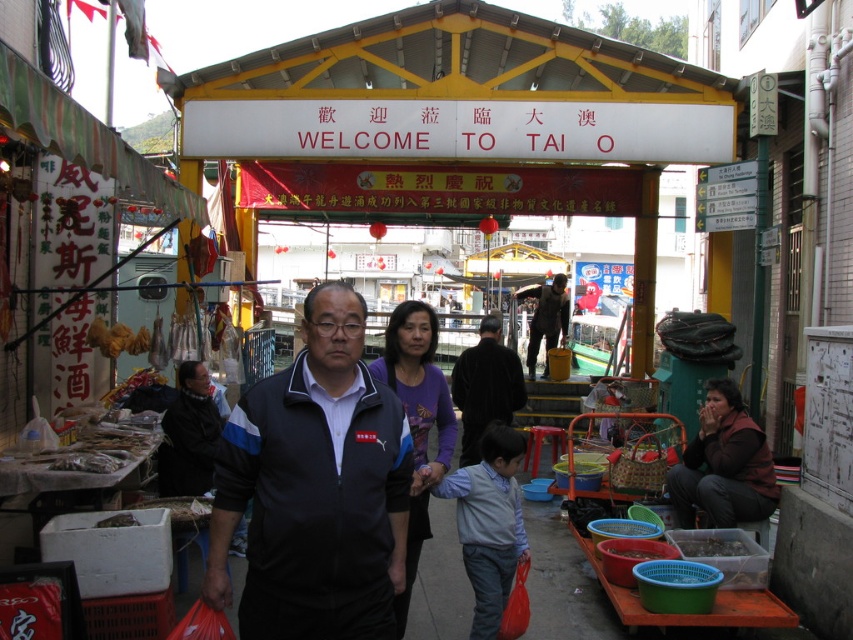
Question: Which of the following is the closest to the observer?

Choices:
 (A) brown fuzzy jacket at lower right
 (B) dark brown jacket at center

Answer: (A)

Question: Can you confirm if brown fuzzy jacket at lower right is positioned to the left of dark brown leather jacket at center?

Choices:
 (A) yes
 (B) no

Answer: (B)

Question: Which point is farther to the camera?

Choices:
 (A) (737, 554)
 (B) (552, 282)
 (C) (335, 477)

Answer: (B)

Question: Is brown fuzzy jacket at lower right positioned at the back of translucent plastic container at lower right?

Choices:
 (A) yes
 (B) no

Answer: (A)

Question: Which of these objects is positioned closest to the dark brown jacket at center?

Choices:
 (A) translucent plastic container at lower right
 (B) dark brown leather jacket at center

Answer: (A)

Question: Is brown fuzzy jacket at lower right to the left of translucent plastic container at lower right from the viewer's perspective?

Choices:
 (A) yes
 (B) no

Answer: (B)